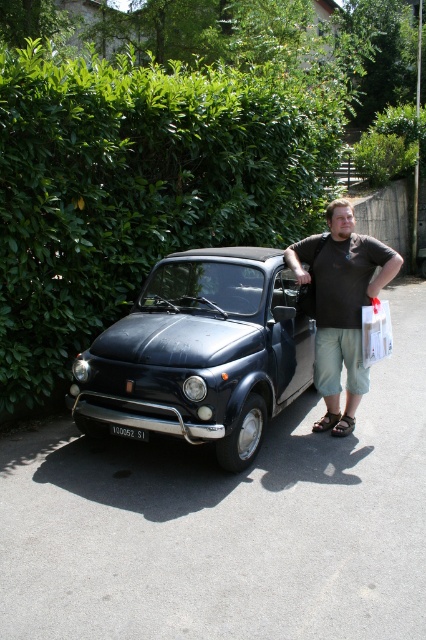
You are a photographer trying to capture the shiny black car at center and the white plastic license plate at center in a single shot. Since the license plate is small, you want to ensure it is visible. Which object should you focus on to make sure both are in focus?

You should focus on the shiny black car at center because it is closer to the viewer than the white plastic license plate at center, so focusing on the closer object will ensure the license plate remains in focus as well.

You are a photographer trying to capture a clear photo of the shiny black car at center and the white plastic license plate at center. Since you want to focus on the car, which object should you zoom in on more to ensure it fills the frame without cropping the license plate?

The shiny black car at center is bigger than the white plastic license plate at center, so you should zoom in more on the shiny black car at center to fill the frame while keeping the license plate visible.

You are a delivery person who needs to place a package on the ground between the matte black shirt at center and the white plastic license plate at center. The package is 3 feet long. Can you fit it between them without moving either object?

The distance between the matte black shirt at center and the white plastic license plate at center is 7.24 feet. Since the package is only 3 feet long, it can easily fit between them without needing to move either object.